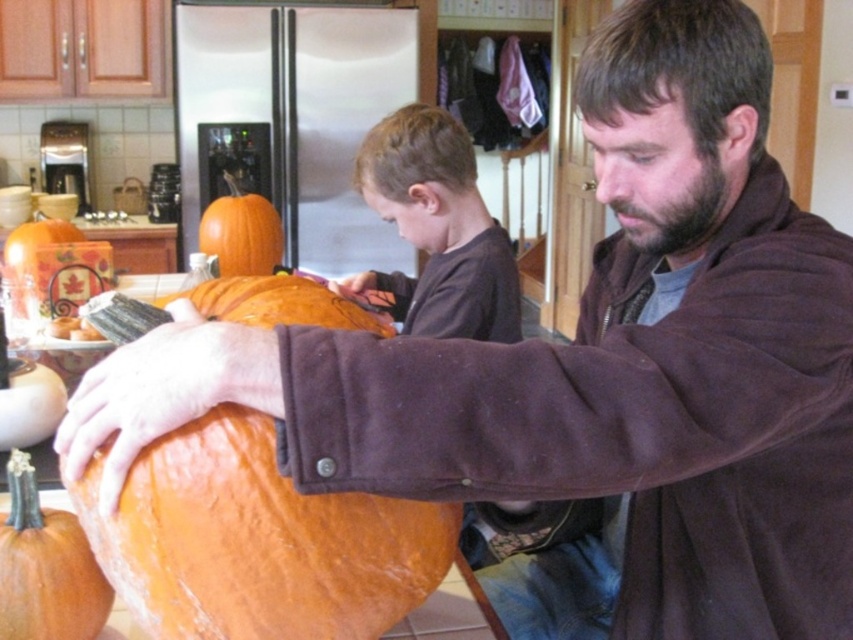
Based on the photo, in the kitchen scene where a man and a boy are carving pumpkins, there is an object located at the coordinate point (437,228). What is the object at that specific coordinate point?

The object at point (437,228) is the smooth orange pumpkin at center.

You are standing in the kitchen and want to reach both points. Which point, point (x=401, y=276) or point (x=262, y=200), is closer to you?

Point (x=401, y=276) is closer to the viewer than point (x=262, y=200).